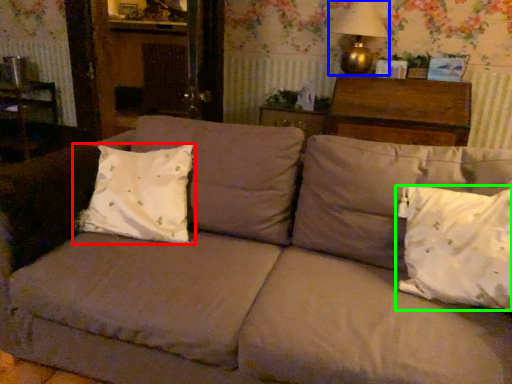
Question: Which is farther away from pillow (highlighted by a red box)? table lamp (highlighted by a blue box) or pillow (highlighted by a green box)?

Choices:
 (A) table lamp
 (B) pillow

Answer: (A)